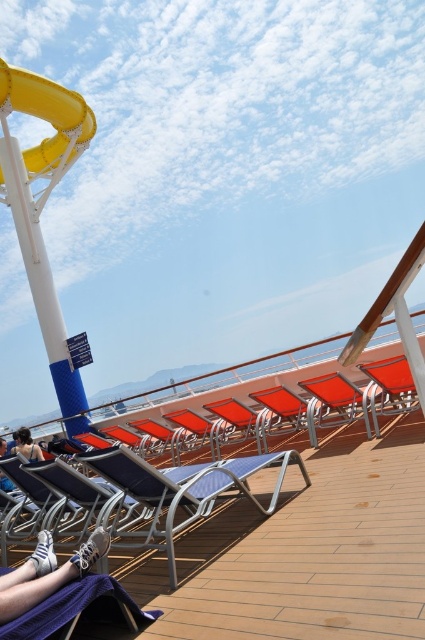
Question: Which object is closer to the camera taking this photo?

Choices:
 (A) yellow rubber slide at upper left
 (B) light blue denim shorts at lower left
 (C) matte blue sneakers at lower left
 (D) orange fabric beach chair at center

Answer: (C)

Question: Considering the real-world distances, which object is farthest from the matte blue sneakers at lower left?

Choices:
 (A) orange fabric beach chair at center
 (B) light blue denim shorts at lower left
 (C) blue fabric beach chair at center
 (D) yellow rubber slide at upper left

Answer: (D)

Question: Which of the following is the closest to the observer?

Choices:
 (A) (39, 451)
 (B) (51, 81)

Answer: (A)

Question: Does matte blue sneakers at lower left have a greater width compared to light blue denim shorts at lower left?

Choices:
 (A) yes
 (B) no

Answer: (B)

Question: Can you confirm if yellow rubber slide at upper left is thinner than light blue denim shorts at lower left?

Choices:
 (A) no
 (B) yes

Answer: (A)

Question: Considering the relative positions of yellow rubber slide at upper left and orange fabric beach chair at center in the image provided, where is yellow rubber slide at upper left located with respect to orange fabric beach chair at center?

Choices:
 (A) right
 (B) left

Answer: (B)